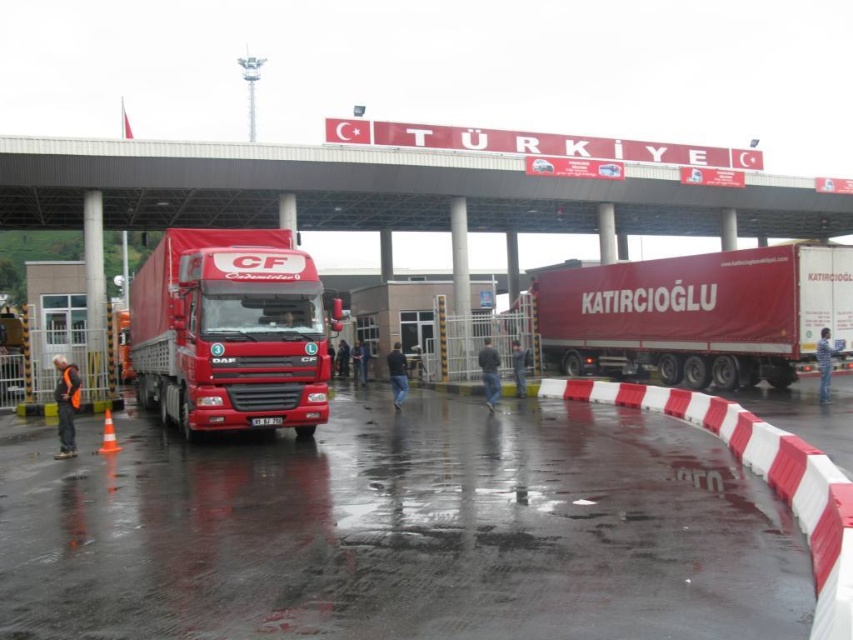
You are a truck driver approaching the border crossing at the Turkish side. Your truck is 12 feet long. You need to know if there is enough space to safely maneuver your truck under the concrete bridge at upper center. Can you determine if the bridge is tall enough based on the given distance?

The concrete bridge at upper center is 86.81 feet away from the camera. However, the height of the bridge is not provided in the description, so it is impossible to determine if it is tall enough for the truck to pass under safely.